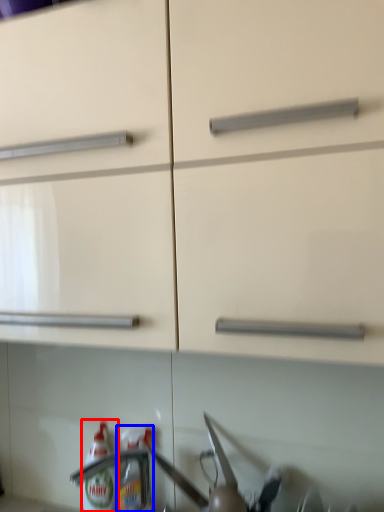
Question: Which of the following is the farthest to the observer, bottle (highlighted by a red box) or bottle (highlighted by a blue box)?

Choices:
 (A) bottle
 (B) bottle

Answer: (A)